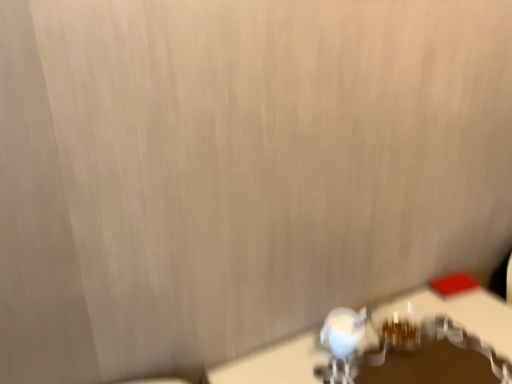
Question: Should I look upward or downward to see white glossy table at lower right?

Choices:
 (A) up
 (B) down

Answer: (B)

Question: Is white glossy table at lower right bigger than white glossy faucet at lower center?

Choices:
 (A) no
 (B) yes

Answer: (B)

Question: Is white glossy table at lower right touching white glossy faucet at lower center?

Choices:
 (A) no
 (B) yes

Answer: (A)

Question: Is white glossy table at lower right positioned before white glossy faucet at lower center?

Choices:
 (A) yes
 (B) no

Answer: (A)

Question: Is white glossy table at lower right at the right side of white glossy faucet at lower center?

Choices:
 (A) yes
 (B) no

Answer: (A)

Question: From the image's perspective, is white glossy table at lower right located above white glossy faucet at lower center?

Choices:
 (A) no
 (B) yes

Answer: (A)

Question: Is white glossy table at lower right shorter than white glossy faucet at lower center?

Choices:
 (A) yes
 (B) no

Answer: (B)

Question: From a real-world perspective, is white glossy faucet at lower center positioned under white glossy table at lower right based on gravity?

Choices:
 (A) yes
 (B) no

Answer: (B)

Question: Considering the relative sizes of white glossy faucet at lower center and white glossy table at lower right in the image provided, is white glossy faucet at lower center bigger than white glossy table at lower right?

Choices:
 (A) yes
 (B) no

Answer: (B)

Question: Can you confirm if white glossy faucet at lower center is shorter than white glossy table at lower right?

Choices:
 (A) yes
 (B) no

Answer: (A)

Question: Is white glossy faucet at lower center closer to the viewer compared to white glossy table at lower right?

Choices:
 (A) no
 (B) yes

Answer: (A)

Question: Considering the relative sizes of white glossy faucet at lower center and white glossy table at lower right in the image provided, is white glossy faucet at lower center wider than white glossy table at lower right?

Choices:
 (A) no
 (B) yes

Answer: (A)

Question: Would you say white glossy table at lower right is part of white glossy faucet at lower center's contents?

Choices:
 (A) yes
 (B) no

Answer: (B)

Question: Does point (492, 304) appear closer or farther from the camera than point (362, 326)?

Choices:
 (A) farther
 (B) closer

Answer: (A)